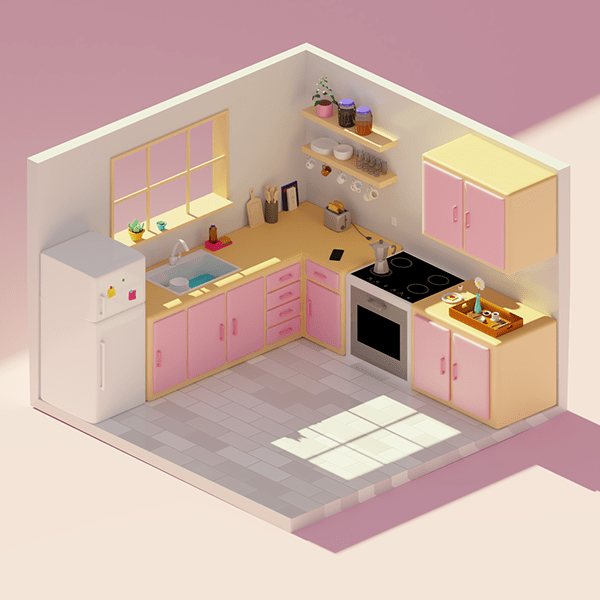
This screenshot has height=600, width=600. Find the location of `refrigerator door`. refrigerator door is located at coordinates 113,359.